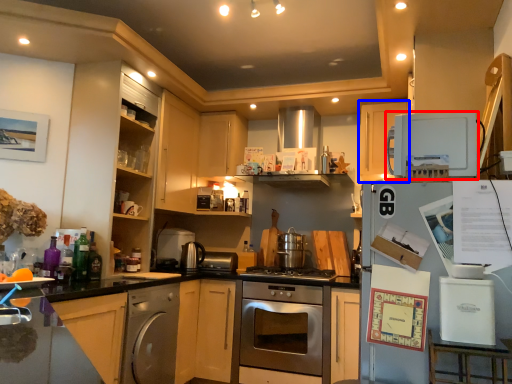
Question: Which of the following is the closest to the observer, home appliance (highlighted by a red box) or cabinetry (highlighted by a blue box)?

Choices:
 (A) home appliance
 (B) cabinetry

Answer: (A)